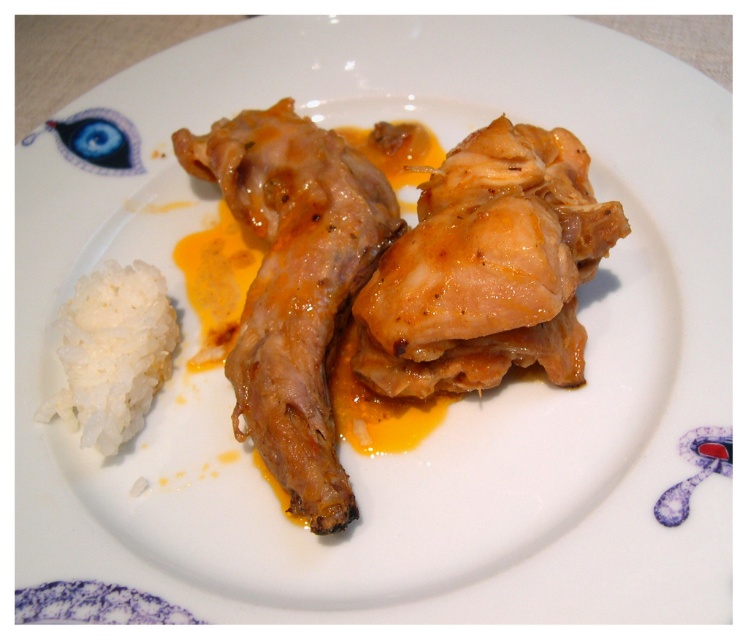
You are a food critic analyzing the composition of this dish. Where is the glossy brown chicken wing at center located on the plate?

The glossy brown chicken wing at center is located at the center of the plate at coordinates approximately 0.447 on the x axis and 0.396 on the y axis.